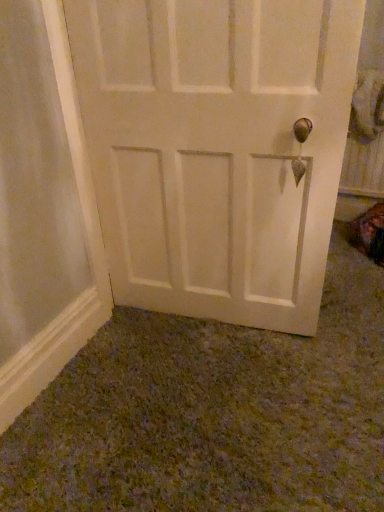
The width and height of the screenshot is (384, 512). Find the location of `free space to the left of white matte door at center`. free space to the left of white matte door at center is located at coordinates (125, 352).